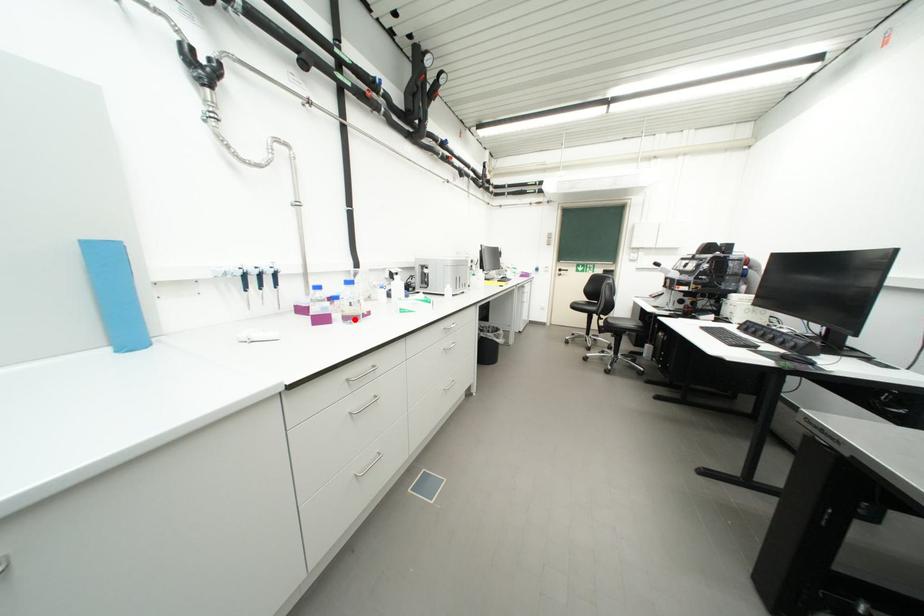
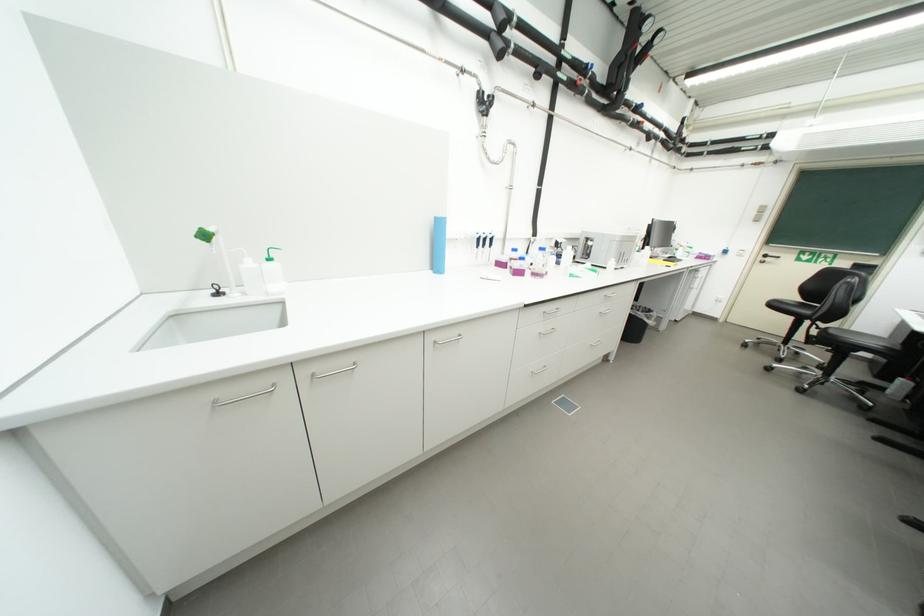
Where in the second image is the point corresponding to the highlighted location from the first image?

(541, 276)